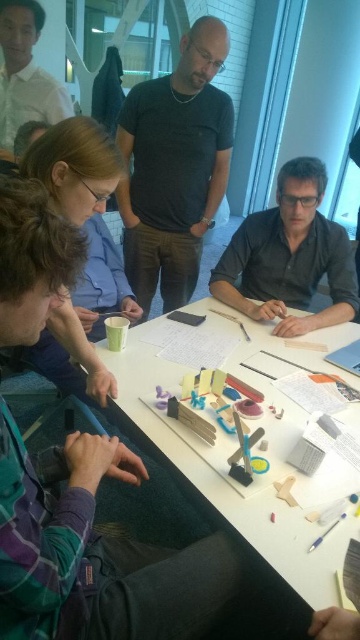
You are standing in front of the table and want to reach both the point at (320, 483) and the point at (11, 16). Which point will require you to move further away from the table?

The point at (11, 16) will require moving further away from the table because it is farther from the viewer compared to the point at (320, 483).

You are standing at the origin point of the room, which is at coordinates 0.000, 0.000. You need to walk to the white matte table at center. According to the coordinates provided, in which direction should you move first?

The white matte table at center is located at coordinates [234,448], which is northeast of your current position at [0,0]. Therefore, you should move northeast first to reach it.

You are standing at point A located at coordinates point A at (195, 189). You need to walk to point B, which is 7.44 feet away. Is this distance within a typical office room? Please explain.

The distance between point A at (195, 189) and point B is 7.44 feet. A typical office room allows for such a distance, so yes, this is within a typical office room.